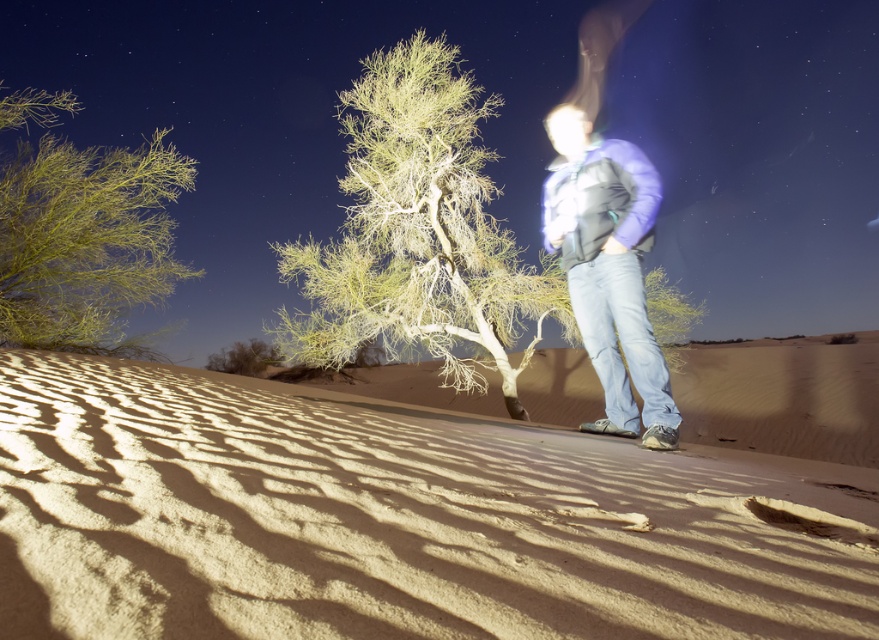
You are standing in the desert at night and see two points in the scene. One is at point (69, 371) and the other is at point (654, 365). Which point is closer to you?

The point at (69, 371) is closer to you because it is further to the viewer than the other point.

Based on the scene description, where is the green leafy shrub at left located in terms of its 2D coordinates?

The green leafy shrub at left is located at the 2D coordinates point (85, 243).

You are standing in the desert scene and want to place a small flashlight on the ground. If you step forward 0.5 meters, will the flashlight land on the smooth sand at center?

The smooth sand at center is 1.04 meters away from the viewer. If you step forward 0.5 meters, you will still be 0.54 meters away from it, so the flashlight will not land on the smooth sand at center.